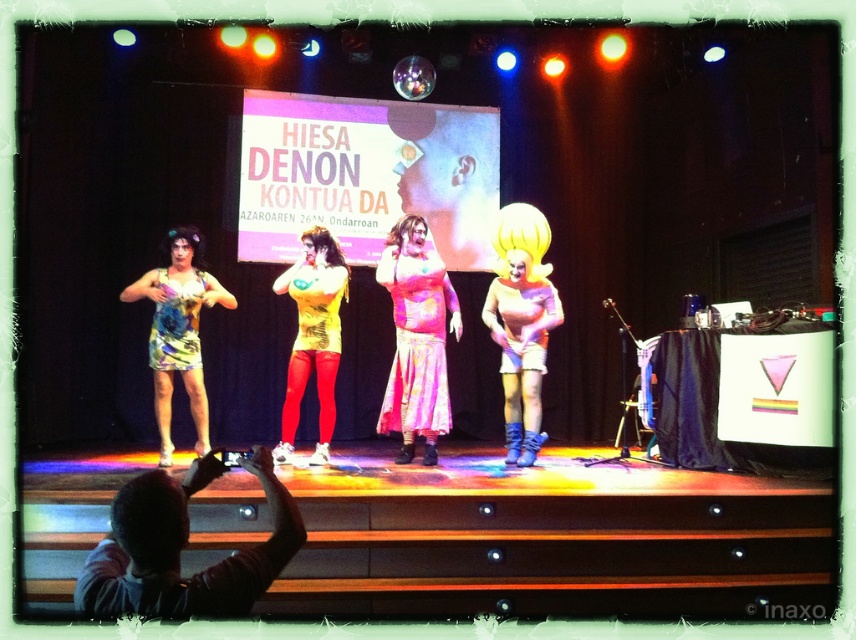
Between point (446, 429) and point (513, 337), which one is positioned behind?

The point (513, 337) is behind.

Is floral chiffon dress at center taller than matte white wig at center?

Indeed, floral chiffon dress at center has a greater height compared to matte white wig at center.

Is point (385, 273) positioned in front of point (514, 333)?

Yes.

Where is `floral chiffon dress at center`? The height and width of the screenshot is (640, 856). floral chiffon dress at center is located at coordinates (417, 344).

Is yellow fabric dress at center wider than floral fabric dress at left?

Correct, the width of yellow fabric dress at center exceeds that of floral fabric dress at left.

Does yellow fabric dress at center come behind floral fabric dress at left?

No, it is in front of floral fabric dress at left.

Is point (343, 282) positioned in front of point (177, 326)?

No, it is not.

Where is `yellow fabric dress at center`? The height and width of the screenshot is (640, 856). yellow fabric dress at center is located at coordinates (312, 342).

Which is behind, point (167, 497) or point (325, 445)?

Point (325, 445)

Measure the distance between dark blue fabric at lower left and yellow fabric dress at center.

3.36 meters

From the picture: Measure the distance between point (141, 547) and camera.

Point (141, 547) and camera are 1.95 meters apart from each other.

You are a GUI agent. You are given a task and a screenshot of the screen. Output one action in this format:
    pyautogui.click(x=<x>, y=<y>)
    Task: Click on the dark blue fabric at lower left
    The width and height of the screenshot is (856, 640).
    Given the screenshot: What is the action you would take?
    pyautogui.click(x=181, y=548)